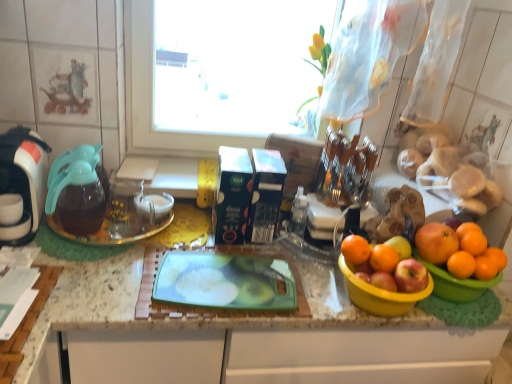
Question: From a real-world perspective, is orange matte at right, which is the 3th orange from right to left, located beneath orange matte at right, the 6th orange viewed from the right?

Choices:
 (A) no
 (B) yes

Answer: (A)

Question: Can we say orange matte at right, placed as the fourth orange when sorted from left to right, lies outside orange matte at right, the 6th orange viewed from the right?

Choices:
 (A) yes
 (B) no

Answer: (A)

Question: Is the depth of orange matte at right, placed as the fourth orange when sorted from left to right, less than that of orange matte at right, which is the first orange from left to right?

Choices:
 (A) no
 (B) yes

Answer: (B)

Question: Considering the relative sizes of orange matte at right, which is the 3th orange from right to left, and orange matte at right, the 6th orange viewed from the right, in the image provided, is orange matte at right, which is the 3th orange from right to left, shorter than orange matte at right, the 6th orange viewed from the right,?

Choices:
 (A) yes
 (B) no

Answer: (A)

Question: Can you confirm if orange matte at right, placed as the fourth orange when sorted from left to right, is wider than orange matte at right, the 6th orange viewed from the right?

Choices:
 (A) no
 (B) yes

Answer: (A)

Question: Is red matte apple at right wider or thinner than orange matte at right, which ranks as the 6th orange in left-to-right order?

Choices:
 (A) thin
 (B) wide

Answer: (B)

Question: From a real-world perspective, is red matte apple at right positioned above or below orange matte at right, which appears as the 1th orange when viewed from the right?

Choices:
 (A) above
 (B) below

Answer: (B)

Question: From the image's perspective, is red matte apple at right positioned above or below orange matte at right, which ranks as the 6th orange in left-to-right order?

Choices:
 (A) below
 (B) above

Answer: (A)

Question: In terms of height, does red matte apple at right look taller or shorter compared to orange matte at right, which ranks as the 6th orange in left-to-right order?

Choices:
 (A) short
 (B) tall

Answer: (B)

Question: Would you say yellow plastic bowl at right, positioned as the second basin in left-to-right order, is inside or outside transparent glass plate at left?

Choices:
 (A) inside
 (B) outside

Answer: (B)

Question: Based on their positions, is yellow plastic bowl at right, which ranks as the 1th basin in right-to-left order, located to the left or right of transparent glass plate at left?

Choices:
 (A) left
 (B) right

Answer: (B)

Question: From a real-world perspective, is yellow plastic bowl at right, positioned as the second basin in left-to-right order, positioned above or below transparent glass plate at left?

Choices:
 (A) above
 (B) below

Answer: (A)

Question: In terms of width, does yellow plastic bowl at right, positioned as the second basin in left-to-right order, look wider or thinner when compared to transparent glass plate at left?

Choices:
 (A) wide
 (B) thin

Answer: (B)

Question: Is orange matte at right, arranged as the 5th orange when viewed from the left, inside the boundaries of green plastic cutting board at center, or outside?

Choices:
 (A) outside
 (B) inside

Answer: (A)

Question: Is orange matte at right, placed as the 2th orange when sorted from right to left, to the left or to the right of green plastic cutting board at center in the image?

Choices:
 (A) left
 (B) right

Answer: (B)